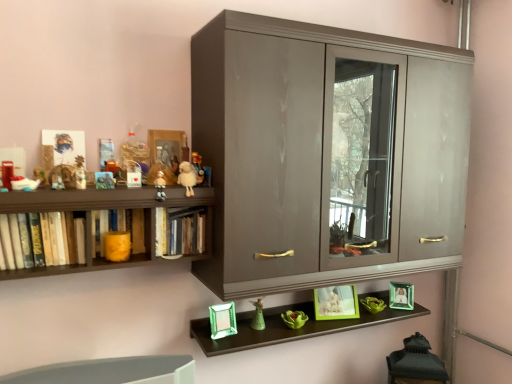
Question: From a real-world perspective, is green matte figurine at center, which appears as the 7th toy when viewed from the top, positioned above or below matte plastic toy at upper left, which is counted as the 2th toy, starting from the top?

Choices:
 (A) above
 (B) below

Answer: (B)

Question: In terms of height, does green matte figurine at center, the seventh toy when ordered from front to back, look taller or shorter compared to matte plastic toy at upper left, arranged as the fifth toy when viewed from the front?

Choices:
 (A) short
 (B) tall

Answer: (B)

Question: Based on their relative distances, which object is farther from the green plastic picture frame at lower center, which appears as the 2th picture frame when viewed from the left?

Choices:
 (A) glossy wood cupboard at center
 (B) matte wooden picture frame at upper center, the 3th picture frame ordered from the bottom
 (C) fluffy white lamb at upper center, marked as the fifth toy in a left-to-right arrangement
 (D) green glass photo frame at lower right, placed as the 3th picture frame when sorted from top to bottom
 (E) green matte figurine at center, marked as the 7th toy in a left-to-right arrangement

Answer: (B)

Question: Estimate the real-world distances between objects in this image. Which object is farther from the matte plastic toy at upper left, the second toy from the front?

Choices:
 (A) orange matte candle at left, arranged as the second book when viewed from the left
 (B) matte plastic toy at upper left, acting as the 3th toy starting from the back
 (C) matte wooden picture frame at upper center, the 3th picture frame ordered from the bottom
 (D) hardcover books at center, acting as the first book starting from the right
 (E) matte plastic toy at upper center, the 5th toy positioned from the back

Answer: (D)